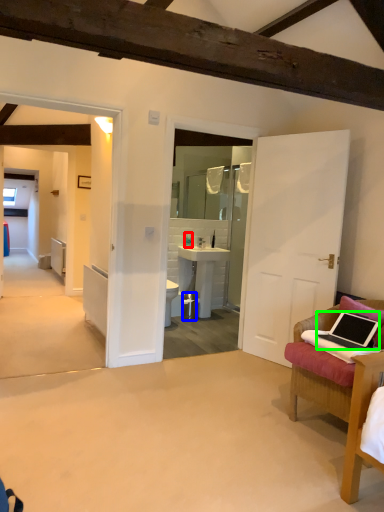
Question: Considering the real-world distances, which object is closest to bottle (highlighted by a red box)? trash bin/can (highlighted by a blue box) or laptop (highlighted by a green box).

Choices:
 (A) trash bin/can
 (B) laptop

Answer: (A)